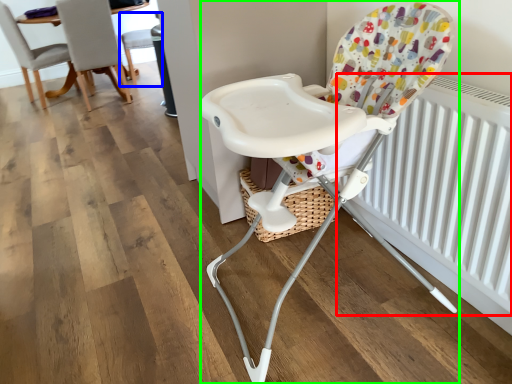
Question: Estimate the real-world distances between objects in this image. Which object is closer to radiator (highlighted by a red box), chair (highlighted by a blue box) or chair (highlighted by a green box)?

Choices:
 (A) chair
 (B) chair

Answer: (B)